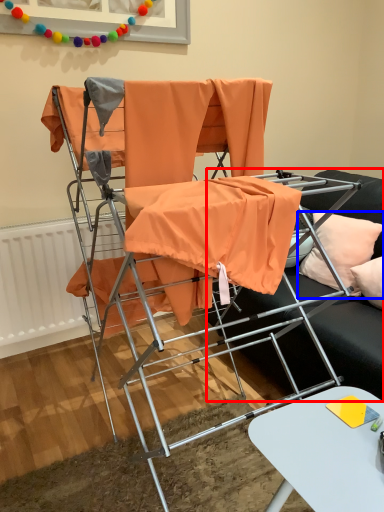
Question: Which of the following is the closest to the observer, studio couch (highlighted by a red box) or pillow (highlighted by a blue box)?

Choices:
 (A) studio couch
 (B) pillow

Answer: (A)